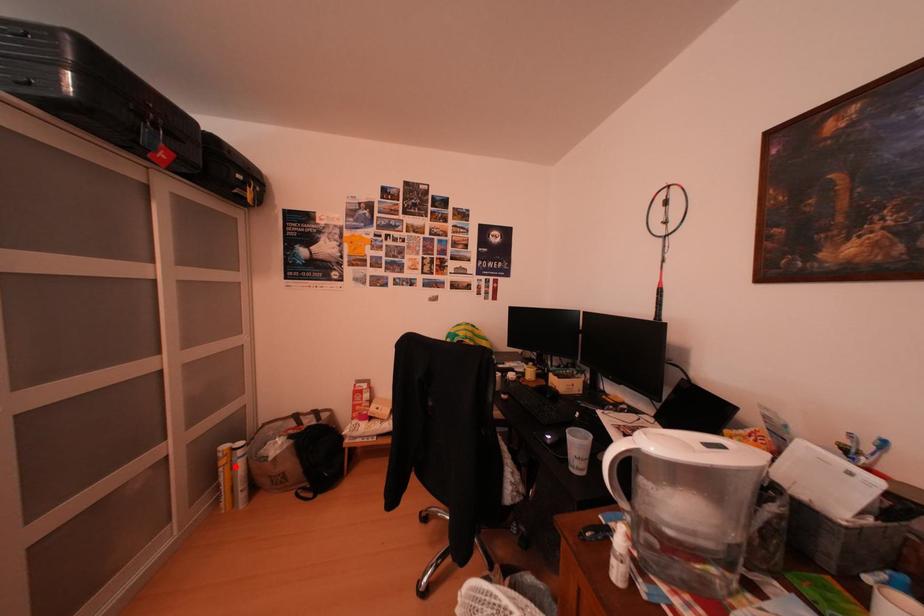
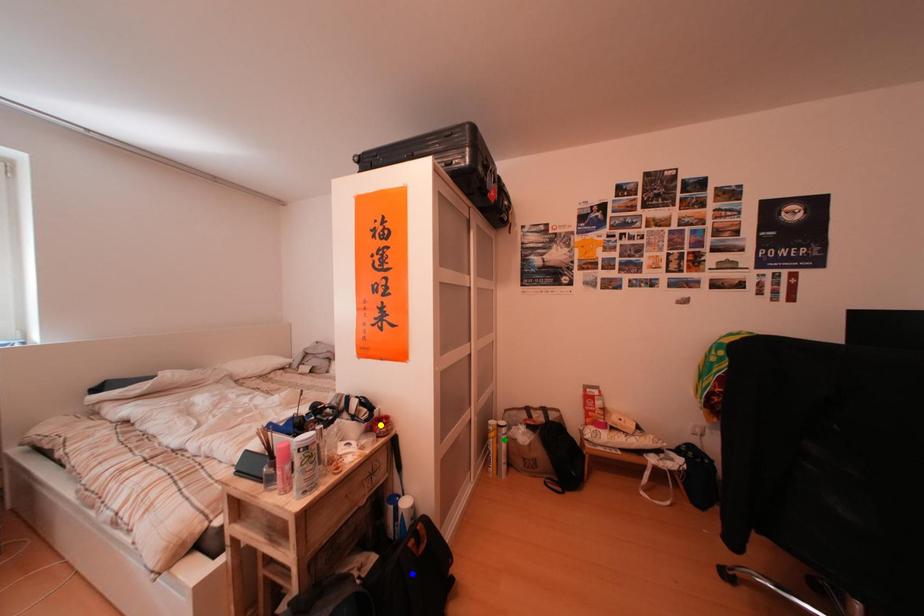
Question: I am providing you with two images of the same scene from different viewpoints. A red point is marked on the first image. You are given multiple points on the second image. Which spot in image 2 lines up with the point in image 1?

Choices:
 (A) green point
 (B) blue point
 (C) yellow point

Answer: (A)